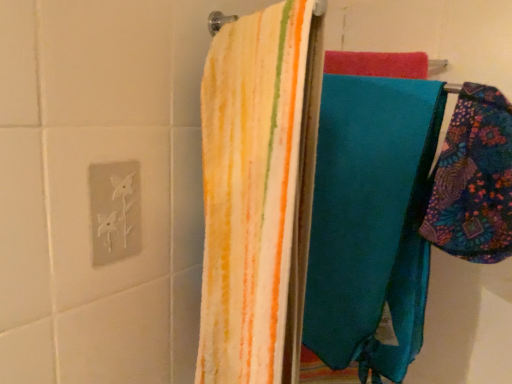
Question: Considering the positions of floral patchwork fabric at right and white matte electric outlet at upper left in the image, is floral patchwork fabric at right taller or shorter than white matte electric outlet at upper left?

Choices:
 (A) short
 (B) tall

Answer: (B)

Question: Choose the correct answer: Is floral patchwork fabric at right inside white matte electric outlet at upper left or outside it?

Choices:
 (A) outside
 (B) inside

Answer: (A)

Question: In the image, is floral patchwork fabric at right positioned in front of or behind white matte electric outlet at upper left?

Choices:
 (A) behind
 (B) front

Answer: (B)

Question: Is white matte electric outlet at upper left spatially inside floral patchwork fabric at right, or outside of it?

Choices:
 (A) outside
 (B) inside

Answer: (A)

Question: Is white matte electric outlet at upper left to the left or to the right of floral patchwork fabric at right in the image?

Choices:
 (A) left
 (B) right

Answer: (A)

Question: Looking at their shapes, would you say white matte electric outlet at upper left is wider or thinner than floral patchwork fabric at right?

Choices:
 (A) wide
 (B) thin

Answer: (B)

Question: From the image's perspective, relative to floral patchwork fabric at right, is white matte electric outlet at upper left above or below?

Choices:
 (A) below
 (B) above

Answer: (A)